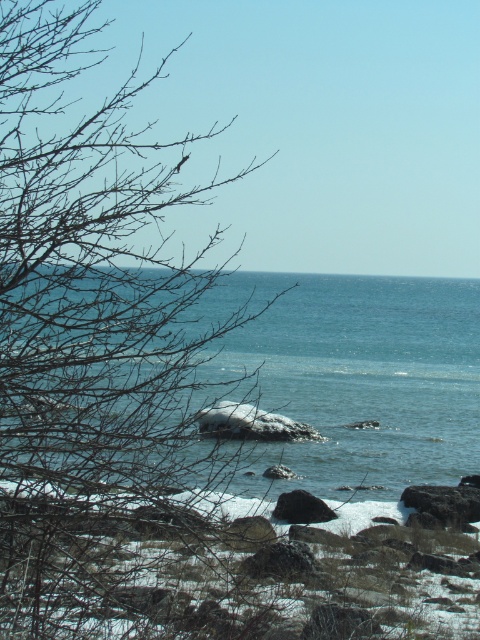
Question: Is bare branches at left above smooth gray rock at center?

Choices:
 (A) no
 (B) yes

Answer: (B)

Question: Among these points, which one is nearest to the camera?

Choices:
 (A) (x=81, y=177)
 (B) (x=452, y=403)
 (C) (x=453, y=506)

Answer: (A)

Question: Based on their relative distances, which object is farther from the smooth gray rock at lower right?

Choices:
 (A) smooth gray rock at center
 (B) blue water at center
 (C) bare branches at left

Answer: (B)

Question: Which object appears farthest from the camera in this image?

Choices:
 (A) smooth gray rock at center
 (B) blue water at center
 (C) smooth gray rock at lower right

Answer: (A)

Question: Can you confirm if blue water at center is positioned to the right of smooth gray rock at center?

Choices:
 (A) no
 (B) yes

Answer: (B)

Question: Is blue water at center below smooth gray rock at center?

Choices:
 (A) yes
 (B) no

Answer: (B)